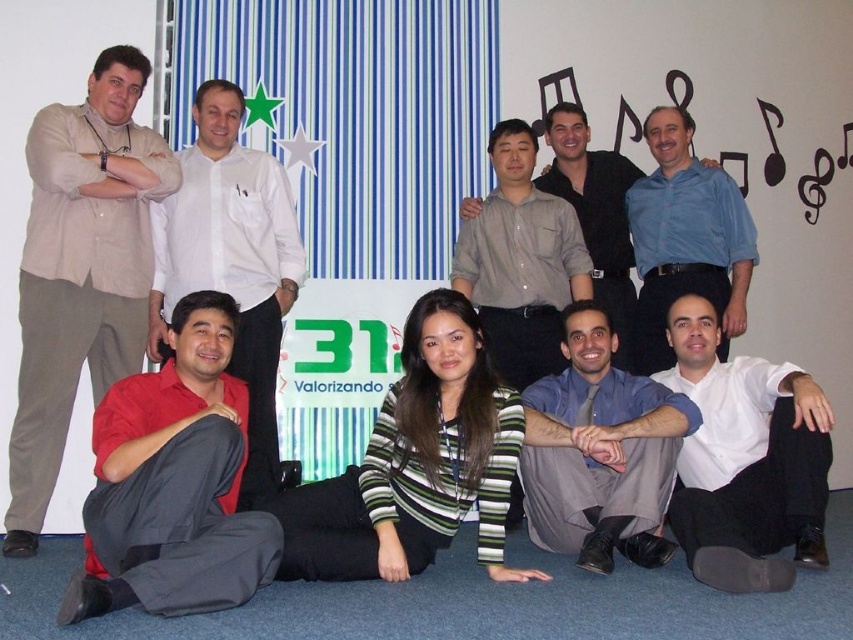
Can you confirm if red satin shirt at lower left is positioned above blue shirt at center?

Actually, red satin shirt at lower left is below blue shirt at center.

Does red satin shirt at lower left come in front of blue shirt at center?

Yes, it is in front of blue shirt at center.

The image size is (853, 640). Find the location of `red satin shirt at lower left`. red satin shirt at lower left is located at coordinates (173, 483).

Find the location of a particular element. The width and height of the screenshot is (853, 640). red satin shirt at lower left is located at coordinates (173, 483).

Looking at this image, who is positioned more to the right, white glossy shirt at lower right or red shirt at lower left?

Positioned to the right is white glossy shirt at lower right.

Is white glossy shirt at lower right further to camera compared to red shirt at lower left?

No, white glossy shirt at lower right is in front of red shirt at lower left.

Between point (671, 515) and point (163, 259), which one is positioned behind?

Point (163, 259)

This screenshot has width=853, height=640. I want to click on white glossy shirt at lower right, so click(x=746, y=460).

Is point (325, 532) farther from viewer compared to point (564, 492)?

No, (325, 532) is closer to viewer.

Does striped sweater at center have a greater width compared to blue shirt at lower center?

Correct, the width of striped sweater at center exceeds that of blue shirt at lower center.

Is point (283, 544) less distant than point (566, 440)?

Yes, it is in front of point (566, 440).

You are a GUI agent. You are given a task and a screenshot of the screen. Output one action in this format:
    pyautogui.click(x=<x>, y=<y>)
    Task: Click on the striped sweater at center
    This screenshot has width=853, height=640.
    Given the screenshot: What is the action you would take?
    pyautogui.click(x=416, y=464)